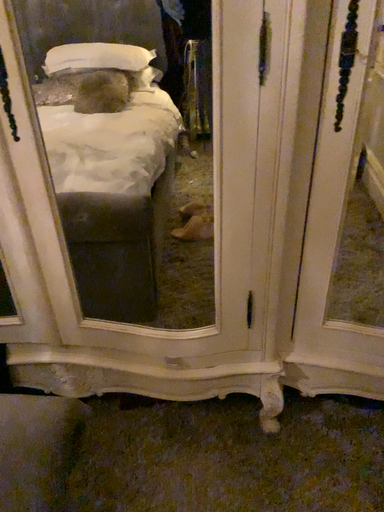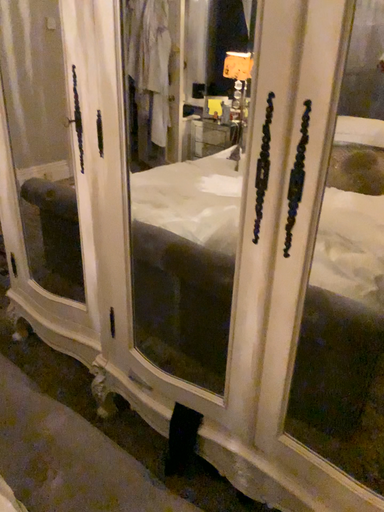
Question: Which way did the camera rotate in the video?

Choices:
 (A) rotated right
 (B) rotated left

Answer: (B)